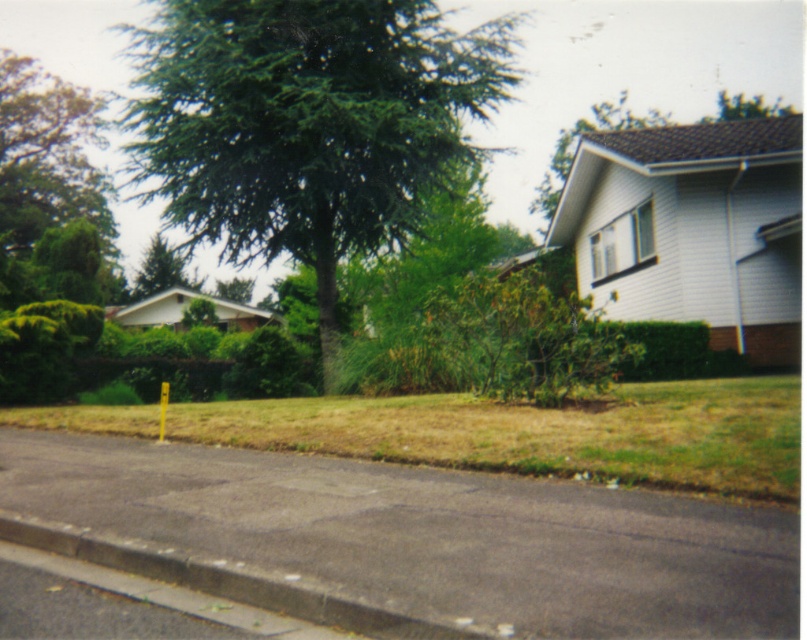
Can you confirm if green needle-like at center is bigger than green leafy tree at upper center?

Yes, green needle-like at center is bigger than green leafy tree at upper center.

Can you confirm if green needle-like at center is positioned above green leafy tree at upper center?

Indeed, green needle-like at center is positioned over green leafy tree at upper center.

Does point (165, 20) lie behind point (555, 164)?

No, (165, 20) is closer to viewer.

At what (x,y) coordinates should I click in order to perform the action: click on green needle-like at center. Please return your answer as a coordinate pair (x, y). Looking at the image, I should click on (307, 124).

Can you confirm if gray concrete curb at lower left is thinner than green leafy tree at upper center?

Yes, gray concrete curb at lower left is thinner than green leafy tree at upper center.

Does gray concrete curb at lower left appear on the right side of green leafy tree at upper center?

In fact, gray concrete curb at lower left is to the left of green leafy tree at upper center.

Is point (310, 605) positioned before point (596, 129)?

Yes.

This screenshot has height=640, width=807. I want to click on gray concrete curb at lower left, so click(x=224, y=580).

Who is higher up, yellow-green grass at lower center or green matte tree at upper left?

green matte tree at upper left

Can you confirm if yellow-green grass at lower center is wider than green matte tree at upper left?

Correct, the width of yellow-green grass at lower center exceeds that of green matte tree at upper left.

Identify the location of yellow-green grass at lower center. The height and width of the screenshot is (640, 807). pos(542,433).

This screenshot has width=807, height=640. Find the location of `yellow-green grass at lower center`. yellow-green grass at lower center is located at coordinates (542, 433).